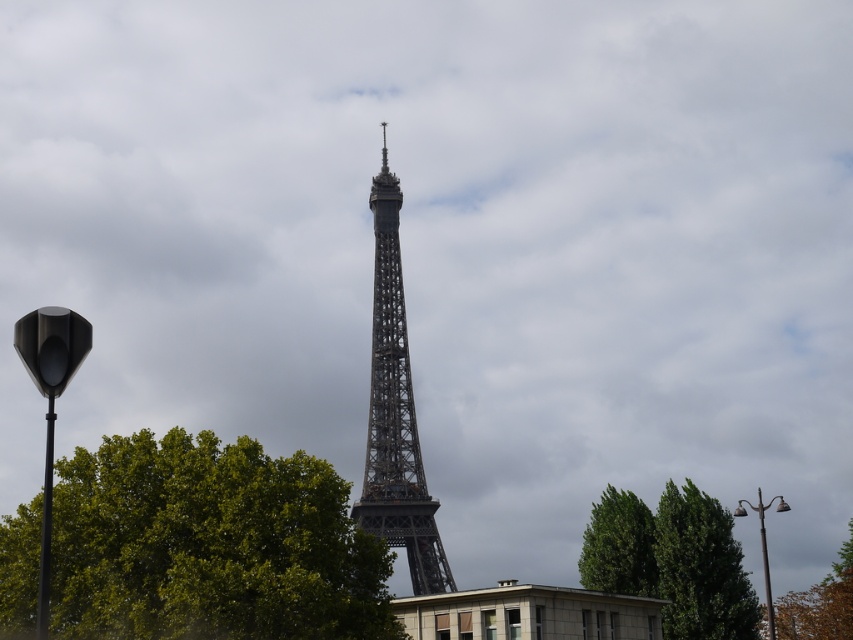
Question: Does green leafy tree at upper right appear on the left side of brown leafy tree at lower right?

Choices:
 (A) yes
 (B) no

Answer: (A)

Question: Where is metallic lattice tower at center located in relation to brown leafy tree at lower right in the image?

Choices:
 (A) above
 (B) below

Answer: (A)

Question: Which point is closer to the camera?

Choices:
 (A) green leafy tree at upper right
 (B) green leafy tree at center

Answer: (B)

Question: Among these points, which one is farthest from the camera?

Choices:
 (A) (380, 320)
 (B) (844, 600)
 (C) (631, 548)

Answer: (A)

Question: Does green leafy tree at lower right have a larger size compared to brown leafy tree at lower right?

Choices:
 (A) no
 (B) yes

Answer: (B)

Question: Considering the real-world distances, which object is closest to the brown leafy tree at lower right?

Choices:
 (A) green leafy tree at center
 (B) green leafy tree at upper right

Answer: (B)